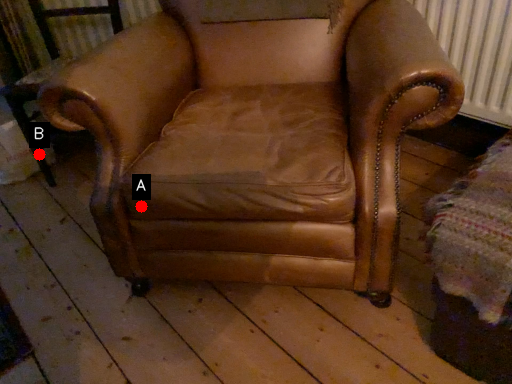
Question: Two points are circled on the image, labeled by A and B beside each circle. Which point appears farthest from the camera in this image?

Choices:
 (A) A is further
 (B) B is further

Answer: (B)